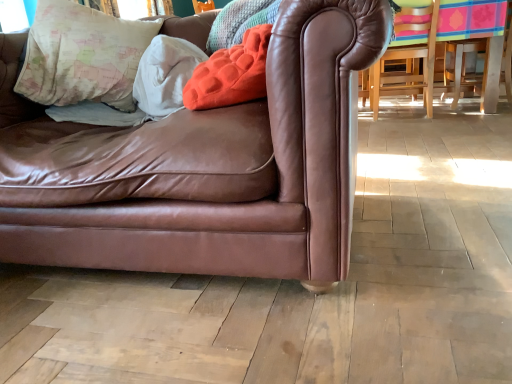
Question: From a real-world perspective, is velvety orange pillow at upper center, which appears as the 3th pillow when viewed from the left, positioned above or below brown leather couch at center?

Choices:
 (A) above
 (B) below

Answer: (A)

Question: Is point (245, 51) positioned closer to the camera than point (52, 132)?

Choices:
 (A) closer
 (B) farther

Answer: (A)

Question: Considering the real-world distances, which object is closest to the velvety orange pillow at upper center, marked as the first pillow in a right-to-left arrangement?

Choices:
 (A) white soft pillow at upper left, which is the 2th pillow from left to right
 (B) map-patterned fabric pillow at upper left, which ranks as the first pillow in left-to-right order
 (C) brown leather couch at center

Answer: (A)

Question: Which of these objects is positioned closest to the brown leather couch at center?

Choices:
 (A) map-patterned fabric pillow at upper left, the third pillow positioned from the right
 (B) velvety orange pillow at upper center, which appears as the 3th pillow when viewed from the left
 (C) white soft pillow at upper left, the second pillow positioned from the right

Answer: (B)